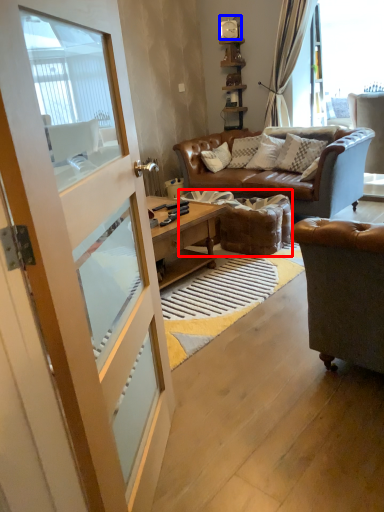
Question: Which of the following is the farthest to the observer, footrest (highlighted by a red box) or clock (highlighted by a blue box)?

Choices:
 (A) footrest
 (B) clock

Answer: (B)